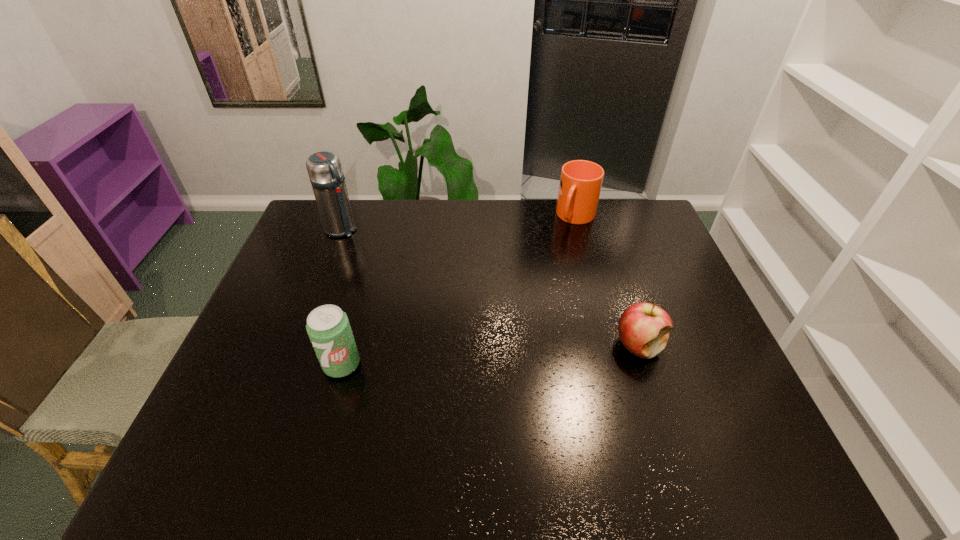
The height and width of the screenshot is (540, 960). I want to click on vacant region located 0.400m with a handle on the side of the leftmost object, so click(423, 297).

Identify the location of vacant area situated with a handle on the side of the leftmost object. The image size is (960, 540). (358, 244).

The image size is (960, 540). In order to click on free space located with a handle on the side of the leftmost object in this screenshot , I will do `click(401, 279)`.

Identify the location of mug that is at the far edge. (580, 185).

Locate an element on the screen. thermos bottle that is at the far edge is located at coordinates (324, 168).

I want to click on object that is at the left edge, so click(324, 168).

Where is `object that is at the right edge`? object that is at the right edge is located at coordinates point(643,328).

Where is `object present at the far left corner`? This screenshot has height=540, width=960. object present at the far left corner is located at coordinates (324, 168).

Locate an element on the screen. This screenshot has width=960, height=540. free region at the far edge of the desktop is located at coordinates (540, 213).

In the image, there is a desktop. In order to click on vacant space at the near edge in this screenshot , I will do `click(588, 402)`.